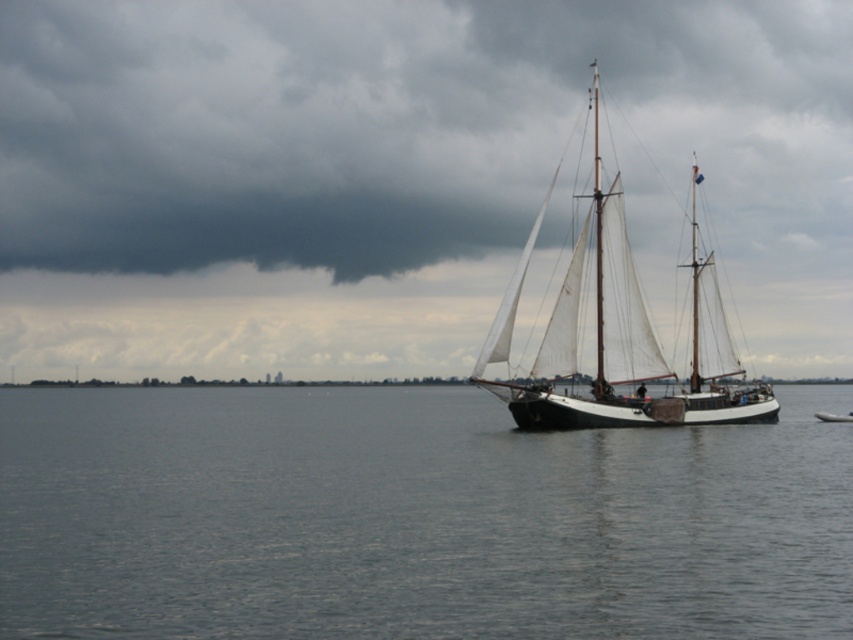
Question: Considering the real-world distances, which object is closest to the dark gray cloud at upper center?

Choices:
 (A) white plastic boat at center
 (B) gray water at center

Answer: (B)

Question: Which object appears farthest from the camera in this image?

Choices:
 (A) gray water at center
 (B) white plastic boat at center
 (C) white canvas sailboat at center
 (D) dark gray cloud at upper center

Answer: (D)

Question: Among these points, which one is nearest to the camera?

Choices:
 (A) (727, 408)
 (B) (708, 573)

Answer: (B)

Question: Can you confirm if gray water at center is smaller than white canvas sailboat at center?

Choices:
 (A) yes
 (B) no

Answer: (A)

Question: In this image, where is gray water at center located relative to white plastic boat at center?

Choices:
 (A) above
 (B) below

Answer: (B)

Question: Is dark gray cloud at upper center positioned behind white plastic boat at center?

Choices:
 (A) no
 (B) yes

Answer: (B)